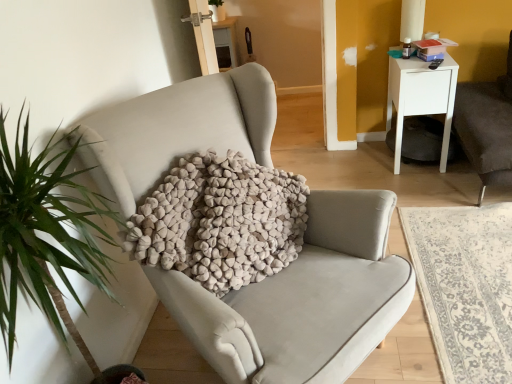
Question: Considering their positions, is textured beige pillow at center located in front of or behind black plastic remote control at upper right?

Choices:
 (A) front
 (B) behind

Answer: (A)

Question: From a real-world perspective, relative to black plastic remote control at upper right, is textured beige pillow at center vertically above or below?

Choices:
 (A) below
 (B) above

Answer: (A)

Question: Based on their relative distances, which object is farther from the white glossy nightstand at upper right?

Choices:
 (A) textured beige pillow at center
 (B) black plastic remote control at upper right
 (C) beige fabric chair at center

Answer: (C)

Question: Estimate the real-world distances between objects in this image. Which object is closer to the white glossy nightstand at upper right?

Choices:
 (A) beige fabric chair at center
 (B) textured beige pillow at center
 (C) black plastic remote control at upper right

Answer: (C)